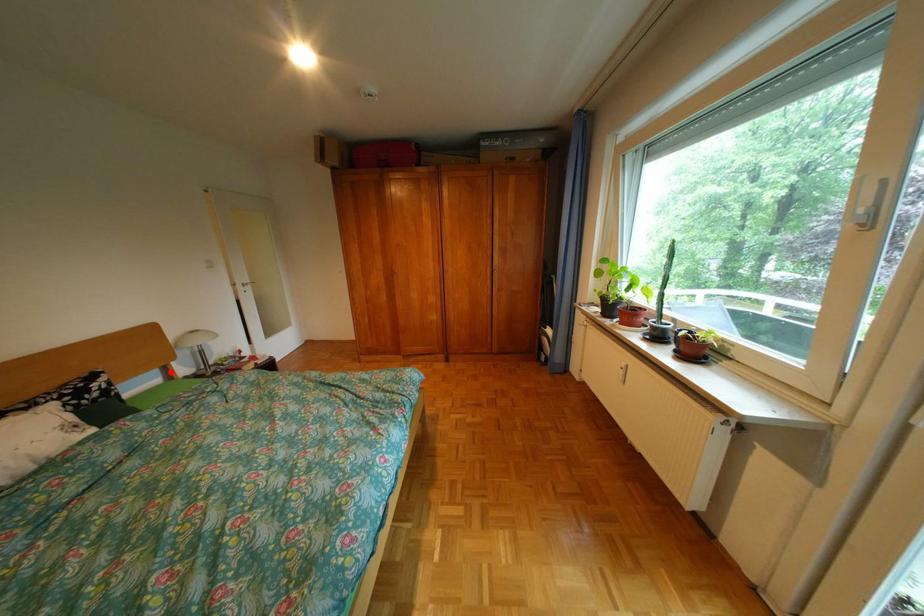
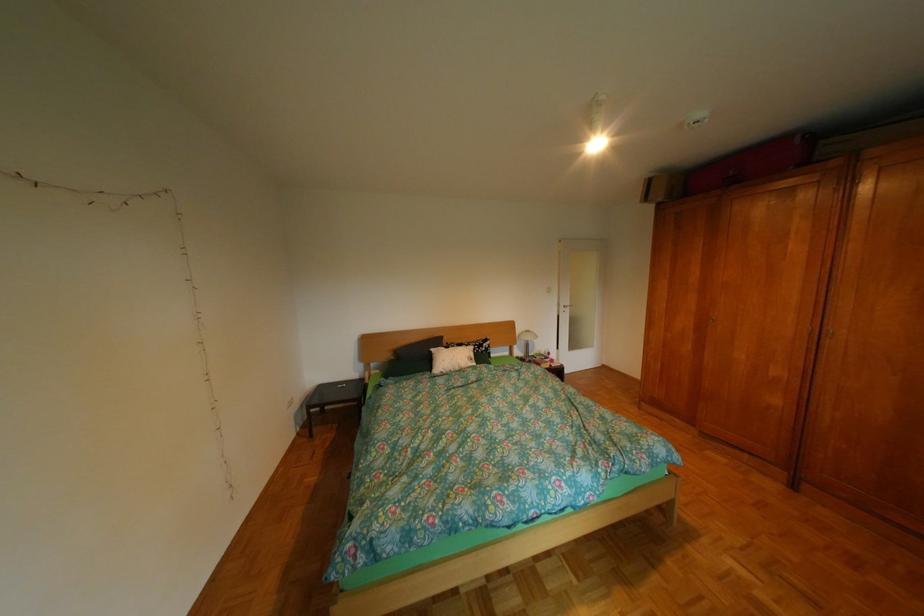
The point at the highlighted location is marked in the first image. Where is the corresponding point in the second image?

(523, 349)